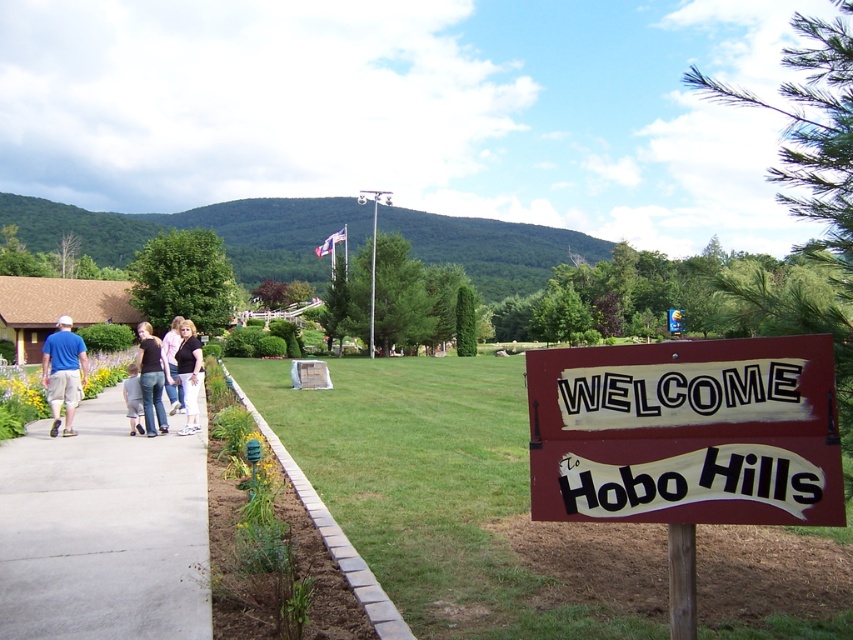
You are a visitor at the entrance of Hobo Hills and see a person wearing a white cotton shirt at left and denim pants at left. Which piece of clothing is larger?

The white cotton shirt at left is larger than the denim pants at left.

You are standing at the entrance of Hobo Hills and want to take a photo of the welcome sign. There are two points marked on the ground in front of you. The first point is at coordinates point (68, 320), and the second is at point (155, 371). Which point should you stand on to ensure the sign is in the background and you are closer to the camera?

You should stand on point (68, 320) because it is further to the camera than point (155, 371), making you closer to the camera and the sign appear in the background.

You are a hiker preparing to enter Hobo Hills and see two shirts hanging on a rack near the entrance. The shirts are the matte blue shirt at left and the white cotton shirt at left. Which shirt takes up more space?

The matte blue shirt at left is bigger than the white cotton shirt at left, so it takes up more space.